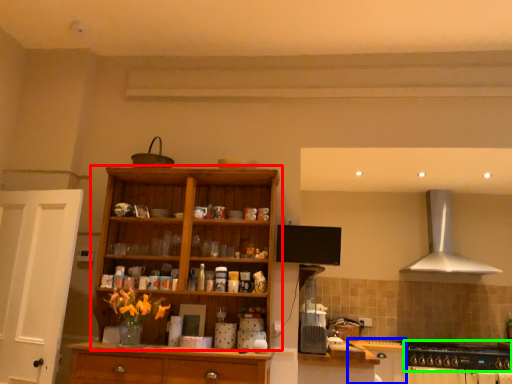
Question: Considering the real-world distances, which object is farthest from cupboard (highlighted by a red box)? cabinetry (highlighted by a blue box) or gas stove (highlighted by a green box)?

Choices:
 (A) cabinetry
 (B) gas stove

Answer: (B)